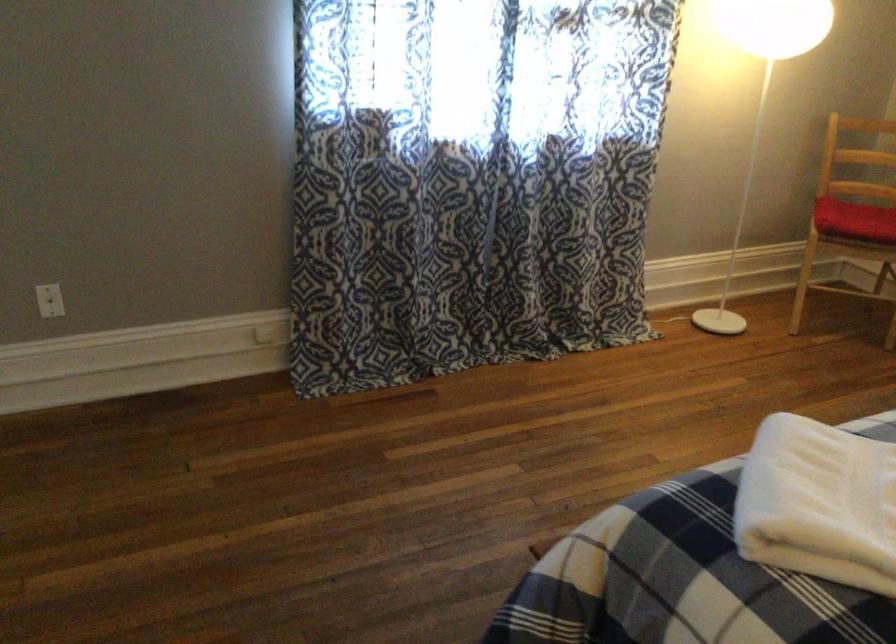
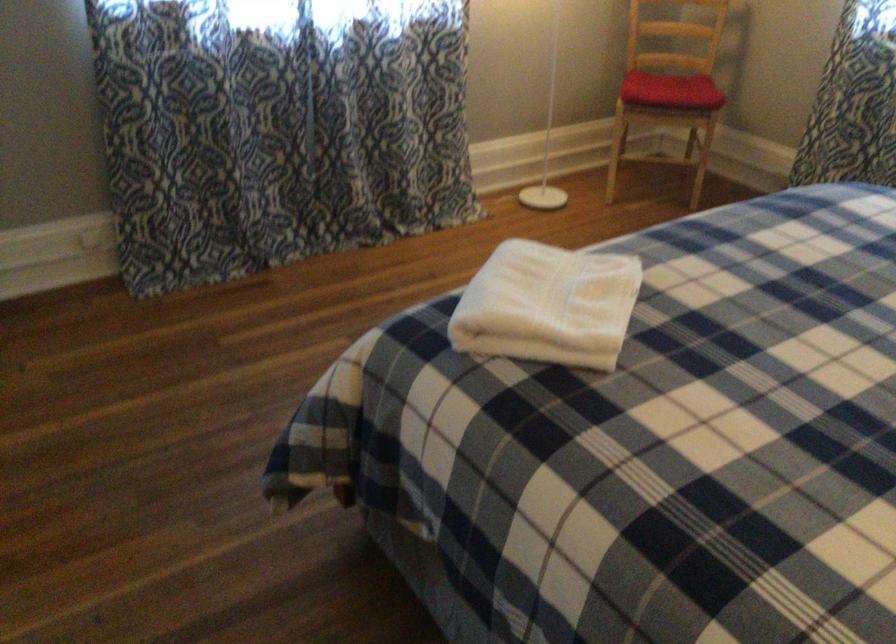
The point at (819,489) is marked in the first image. Where is the corresponding point in the second image?

(547, 305)